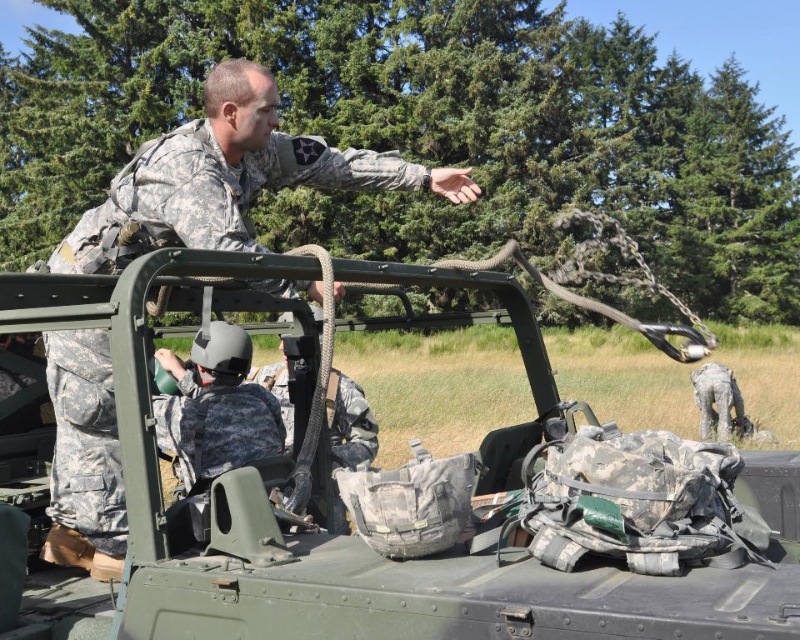
Between point (576, 563) and point (260, 131), which one is positioned behind?

Point (260, 131)

Image resolution: width=800 pixels, height=640 pixels. I want to click on camouflage fabric tank at upper center, so click(409, 492).

Image resolution: width=800 pixels, height=640 pixels. In order to click on camouflage fabric tank at upper center in this screenshot , I will do `click(409, 492)`.